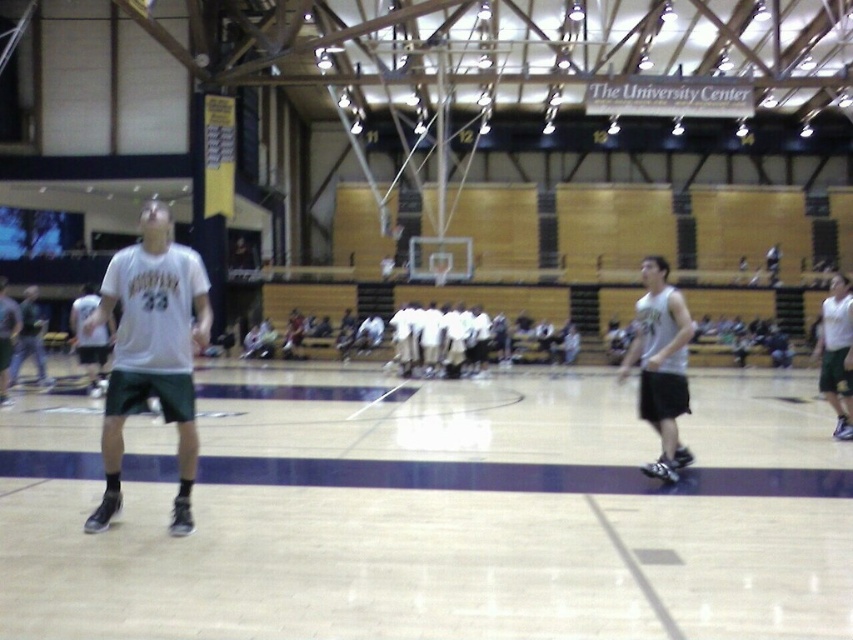
Question: Which of the following is the farthest from the observer?

Choices:
 (A) (33, 332)
 (B) (677, 397)
 (C) (129, 396)

Answer: (A)

Question: Is white matte jersey at center wider than white jersey at left?

Choices:
 (A) no
 (B) yes

Answer: (B)

Question: Is the position of white jersey at center less distant than that of white jersey at left?

Choices:
 (A) no
 (B) yes

Answer: (B)

Question: Considering the relative positions of white matte jersey at center and white jersey at center in the image provided, where is white matte jersey at center located with respect to white jersey at center?

Choices:
 (A) right
 (B) left

Answer: (B)

Question: Which object appears closest to the camera in this image?

Choices:
 (A) white matte jersey at center
 (B) wooden floor at center
 (C) white jersey at center

Answer: (B)

Question: Which object is the farthest from the white matte jersey at center?

Choices:
 (A) wooden floor at center
 (B) white jersey at center

Answer: (B)